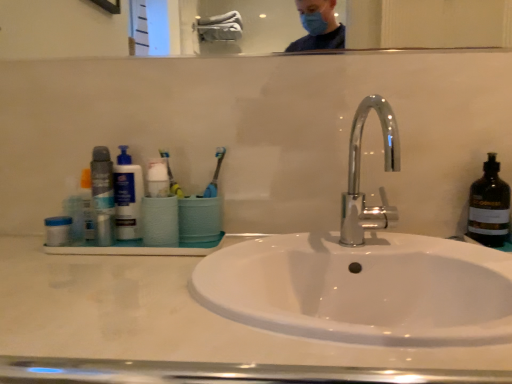
Identify the location of free space in front of blue plastic container at left. (49, 268).